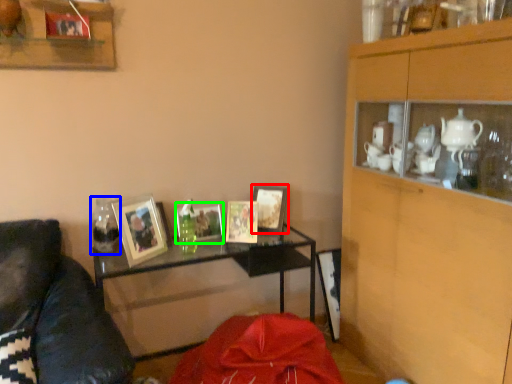
Question: Which object is positioned farthest from picture frame (highlighted by a red box)? Select from glass vase (highlighted by a blue box) and picture frame (highlighted by a green box).

Choices:
 (A) glass vase
 (B) picture frame

Answer: (A)